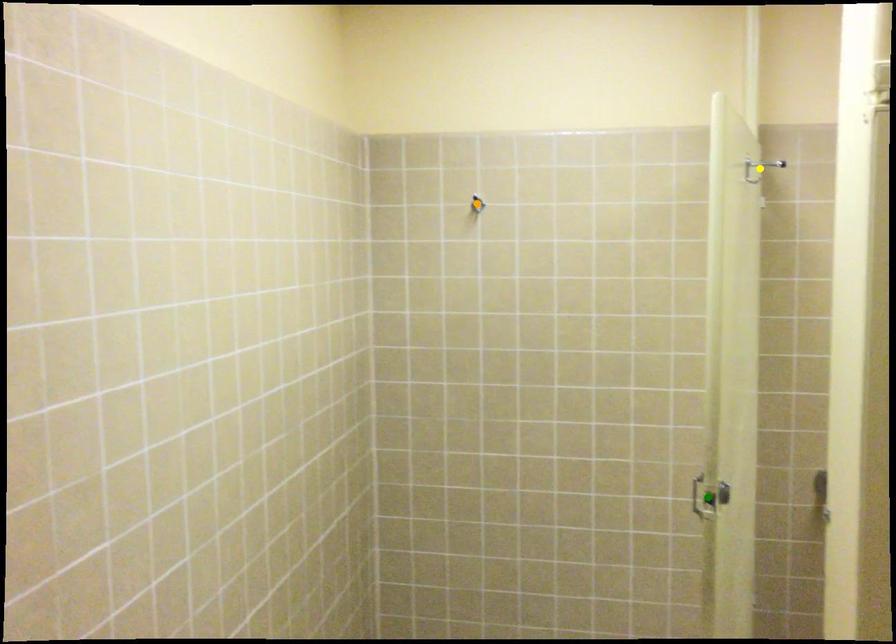
Order these from nearest to farthest:
green point
orange point
yellow point

green point < yellow point < orange point